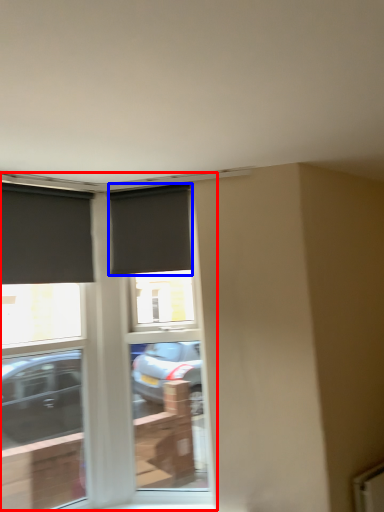
Question: Among these objects, which one is nearest to the camera, window (highlighted by a red box) or window (highlighted by a blue box)?

Choices:
 (A) window
 (B) window

Answer: (A)